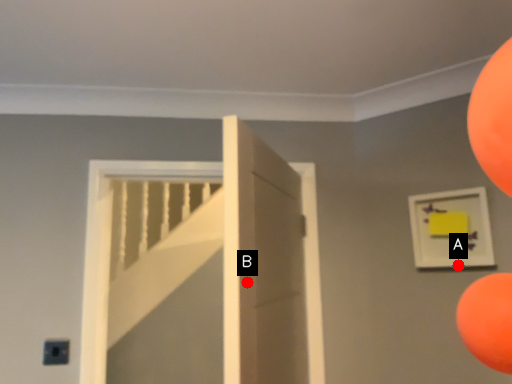
Question: Two points are circled on the image, labeled by A and B beside each circle. Among these points, which one is farthest from the camera?

Choices:
 (A) A is further
 (B) B is further

Answer: (A)